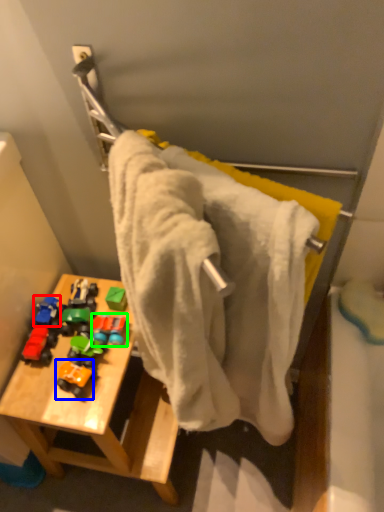
Question: Which object is positioned farthest from toy (highlighted by a red box)? Select from toy (highlighted by a blue box) and toy (highlighted by a green box).

Choices:
 (A) toy
 (B) toy

Answer: (A)